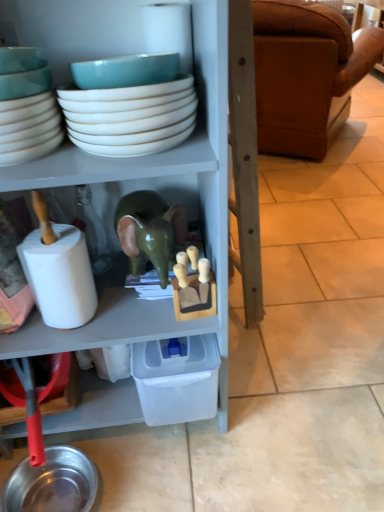
Question: From a real-world perspective, is brown leather couch at right under teal ceramic bowl at upper left, marked as the 1th bowl in a left-to-right arrangement?

Choices:
 (A) yes
 (B) no

Answer: (A)

Question: Would you say brown leather couch at right is outside teal ceramic bowl at upper left, marked as the 2th bowl in a right-to-left arrangement?

Choices:
 (A) yes
 (B) no

Answer: (A)

Question: Is brown leather couch at right to the right of teal ceramic bowl at upper left, marked as the 2th bowl in a right-to-left arrangement, from the viewer's perspective?

Choices:
 (A) yes
 (B) no

Answer: (A)

Question: Is brown leather couch at right thinner than teal ceramic bowl at upper left, marked as the 2th bowl in a right-to-left arrangement?

Choices:
 (A) yes
 (B) no

Answer: (B)

Question: From the image's perspective, is brown leather couch at right over teal ceramic bowl at upper left, marked as the 2th bowl in a right-to-left arrangement?

Choices:
 (A) no
 (B) yes

Answer: (B)

Question: Does brown leather couch at right have a greater height compared to teal ceramic bowl at upper left, marked as the 1th bowl in a left-to-right arrangement?

Choices:
 (A) yes
 (B) no

Answer: (A)

Question: Is brown leather couch at right outside of white matte toilet paper at left?

Choices:
 (A) no
 (B) yes

Answer: (B)

Question: Is white matte toilet paper at left located within brown leather couch at right?

Choices:
 (A) no
 (B) yes

Answer: (A)

Question: Is brown leather couch at right positioned in front of white matte toilet paper at left?

Choices:
 (A) yes
 (B) no

Answer: (B)

Question: Does brown leather couch at right have a lesser height compared to white matte toilet paper at left?

Choices:
 (A) no
 (B) yes

Answer: (A)

Question: Is brown leather couch at right directly adjacent to white matte toilet paper at left?

Choices:
 (A) no
 (B) yes

Answer: (A)

Question: Is brown leather couch at right at the right side of white matte toilet paper at left?

Choices:
 (A) no
 (B) yes

Answer: (B)

Question: Is there a large distance between green glossy elephant at center and teal ceramic bowl at upper left, marked as the 2th bowl in a right-to-left arrangement?

Choices:
 (A) no
 (B) yes

Answer: (A)